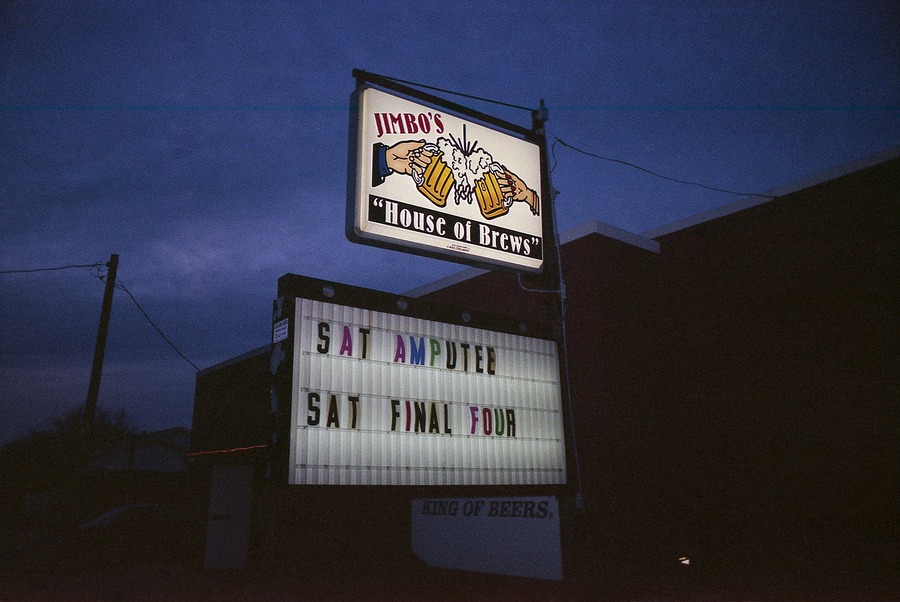
Where is `two beer mugs`? two beer mugs is located at coordinates (492, 200), (439, 188).